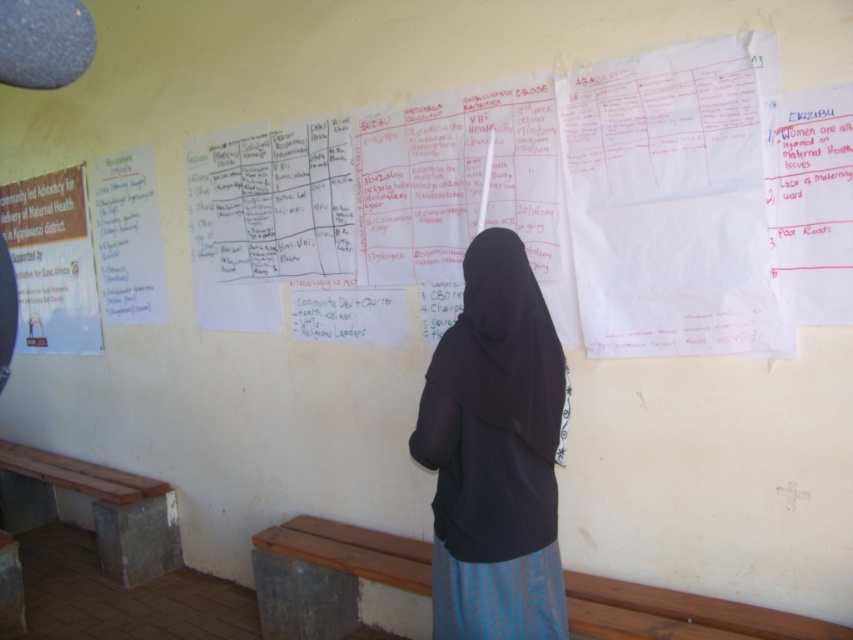
Question: Which object is positioned closest to the wooden bench at lower left?

Choices:
 (A) white paper poster at left
 (B) wooden bench at lower center
 (C) white paper at left
 (D) black fabric at center

Answer: (A)

Question: Is black fabric at center wider than wooden bench at lower center?

Choices:
 (A) no
 (B) yes

Answer: (A)

Question: Can you confirm if wooden bench at lower center is positioned above wooden bench at lower left?

Choices:
 (A) no
 (B) yes

Answer: (A)

Question: Is wooden bench at lower center smaller than white paper at left?

Choices:
 (A) yes
 (B) no

Answer: (A)

Question: Among these objects, which one is nearest to the camera?

Choices:
 (A) wooden bench at lower left
 (B) white paper poster at left
 (C) white paper at left
 (D) wooden bench at lower center

Answer: (D)

Question: Which object is the farthest from the wooden bench at lower left?

Choices:
 (A) white paper at left
 (B) white paper poster at left
 (C) black fabric at center
 (D) wooden bench at lower center

Answer: (C)